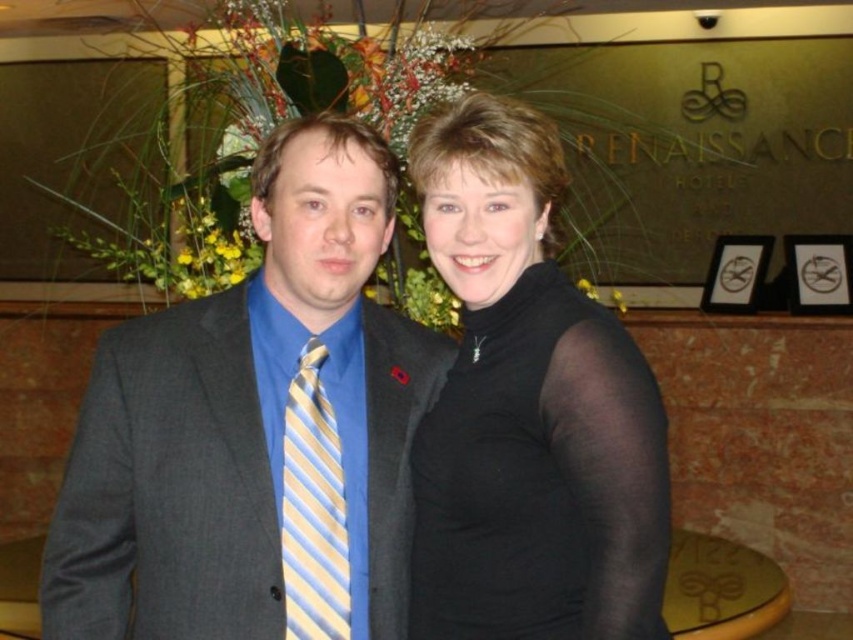
Based on the scene description, where is the matte gray suit at center located in terms of coordinates?

The matte gray suit at center is located at coordinates point (254, 428).

You are standing at the point marked by coordinates point (285, 305). You want to greet both individuals without crossing into their personal space. The recommended personal space distance is 2 feet. Can you approach both of them from your current position?

The two individuals are 4.71 feet apart. Since the recommended personal space distance is 2 feet, you can approach each of them individually while maintaining a safe distance of 2 feet from each, as the total distance between them allows for this separation.

You are a photographer setting up a shot of the two people in the image. You need to place a spotlight exactly at point (527, 412). What object will the spotlight illuminate?

The spotlight at point (527, 412) will illuminate the black matte turtleneck at center.